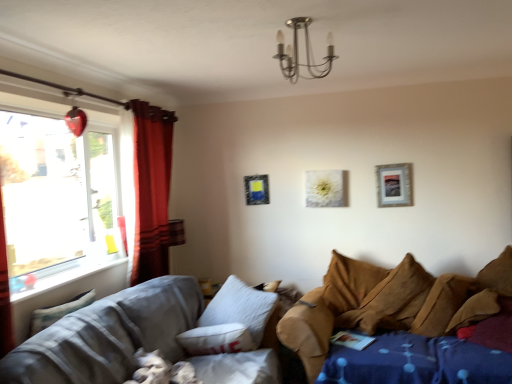
Where is `vacant space situated above metallic chandelier at upper center (from a real-world perspective)`? This screenshot has width=512, height=384. vacant space situated above metallic chandelier at upper center (from a real-world perspective) is located at coordinates (310, 18).